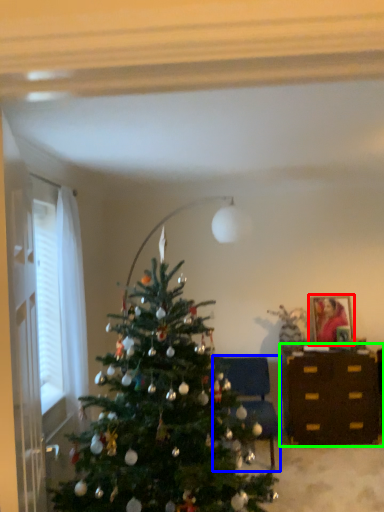
Question: Based on their relative distances, which object is farther from picture frame (highlighted by a red box)? Choose from furniture (highlighted by a blue box) and desk (highlighted by a green box).

Choices:
 (A) furniture
 (B) desk

Answer: (A)